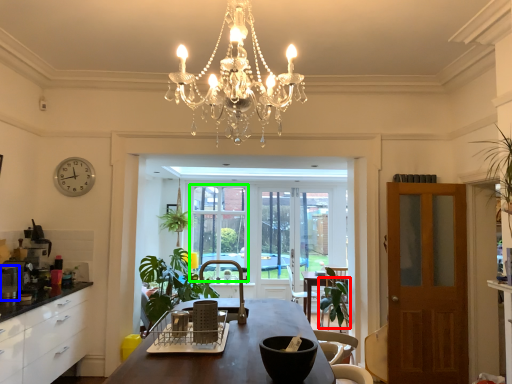
Question: Considering the real-world distances, which object is farthest from armchair (highlighted by a red box)? appliance (highlighted by a blue box) or window screen (highlighted by a green box)?

Choices:
 (A) appliance
 (B) window screen

Answer: (A)